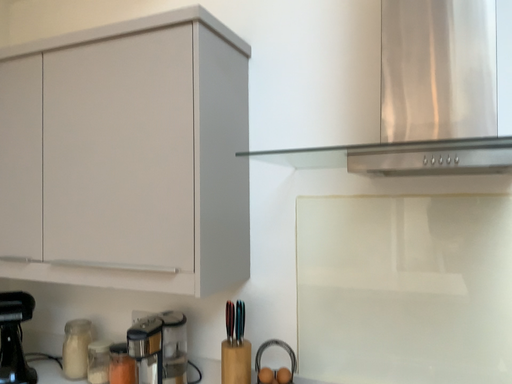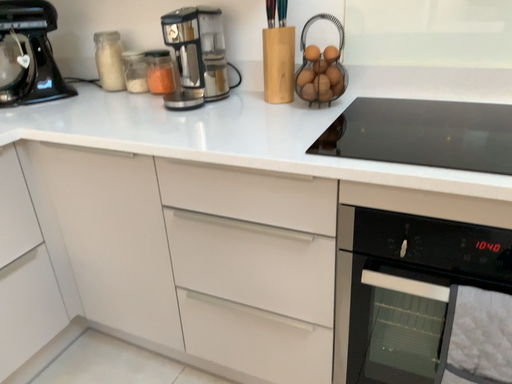
Question: Which way did the camera rotate in the video?

Choices:
 (A) rotated downward
 (B) rotated upward

Answer: (A)